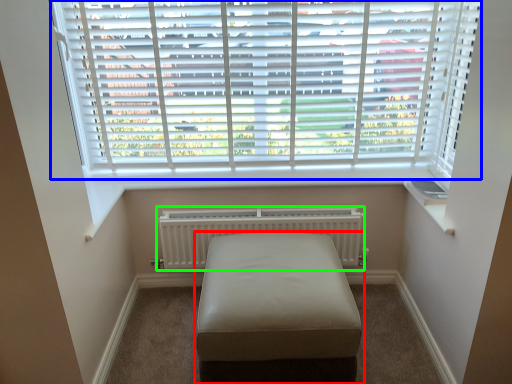
Question: Based on their relative distances, which object is nearer to furniture (highlighted by a red box)? Choose from window blind (highlighted by a blue box) and radiator (highlighted by a green box).

Choices:
 (A) window blind
 (B) radiator

Answer: (B)